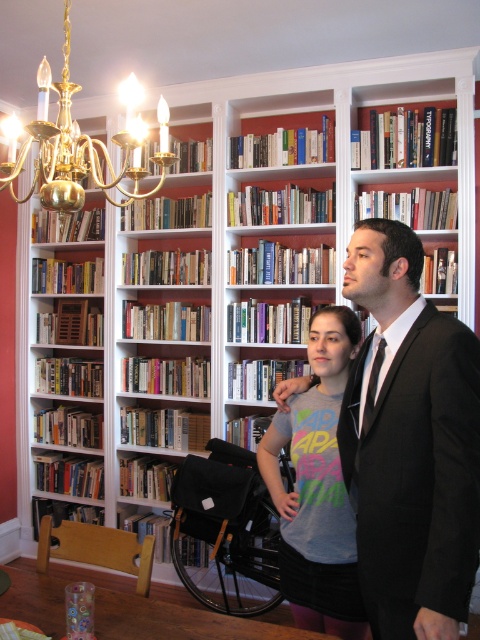
Question: Based on their relative distances, which object is nearer to the black suit at center?

Choices:
 (A) black leather wheelchair at center
 (B) light gray t-shirt at center

Answer: (B)

Question: Is light gray t-shirt at center thinner than gold brass chandelier at upper left?

Choices:
 (A) yes
 (B) no

Answer: (A)

Question: Where is black leather wheelchair at center located in relation to black silk tie at right in the image?

Choices:
 (A) left
 (B) right

Answer: (A)

Question: Is light gray t-shirt at center thinner than gold brass chandelier at upper left?

Choices:
 (A) yes
 (B) no

Answer: (A)

Question: Which point appears farthest from the camera in this image?

Choices:
 (A) [x=376, y=362]
 (B) [x=48, y=122]
 (C) [x=264, y=531]

Answer: (C)

Question: Which point is closer to the camera taking this photo?

Choices:
 (A) (317, 612)
 (B) (460, 515)
 (C) (360, 435)

Answer: (B)